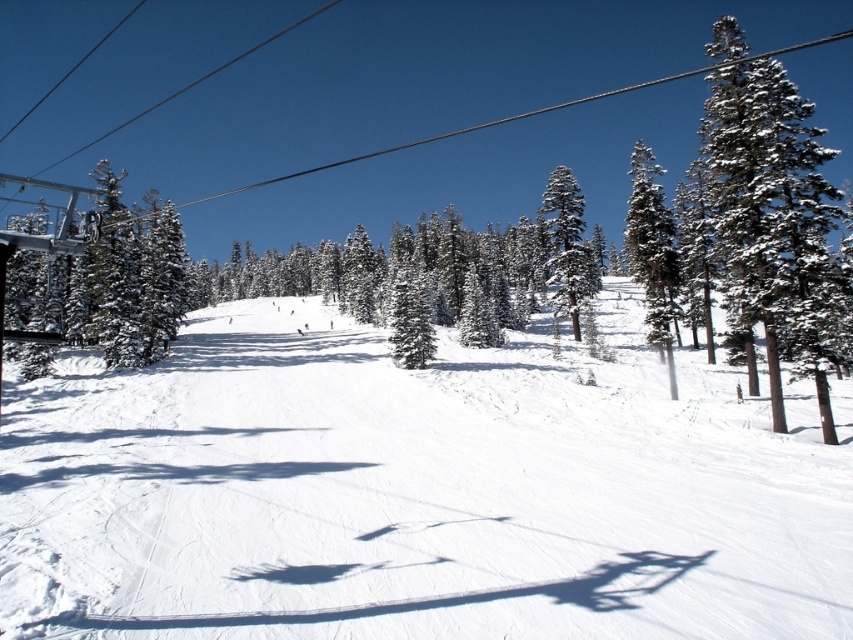
Question: Among these objects, which one is nearest to the camera?

Choices:
 (A) white snow ski slope at center
 (B) snow-covered pine trees at upper right
 (C) snow-covered evergreen tree at center-right

Answer: (A)

Question: Which is nearer to the snow-covered pine trees at upper right?

Choices:
 (A) snow-covered evergreen tree at center-right
 (B) white snow ski slope at center

Answer: (B)

Question: Can you confirm if white snow ski slope at center is positioned above snow-covered evergreen tree at center-right?

Choices:
 (A) no
 (B) yes

Answer: (A)

Question: Considering the relative positions of white snow ski slope at center and snow-covered pine trees at upper right in the image provided, where is white snow ski slope at center located with respect to snow-covered pine trees at upper right?

Choices:
 (A) left
 (B) right

Answer: (A)

Question: Does white snow ski slope at center have a lesser width compared to snow-covered evergreen tree at center-right?

Choices:
 (A) yes
 (B) no

Answer: (B)

Question: Which of the following is the farthest from the observer?

Choices:
 (A) (219, 592)
 (B) (550, 221)

Answer: (B)